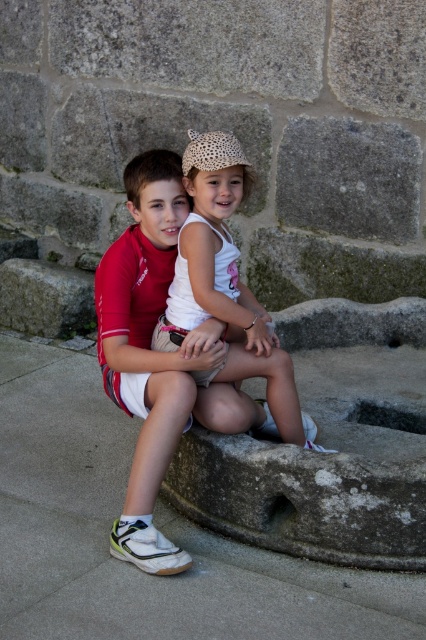
You are a photographer trying to capture a photo of the matte white shirt at center. Based on the coordinates provided in the scene description, where should you position your camera to ensure the shirt is centered in the frame?

The matte white shirt at center is located at point (169, 358), so you should position your camera to aim directly at those coordinates to center it in the frame.

You are a parent trying to decide which stone to let your child sit on. The gray rough stone at center and the green rough stone at center are both available. Which one has a wider surface for sitting?

The gray rough stone at center has a larger width than the green rough stone at center, so it provides a wider surface for sitting.

You see a matte white shirt at center and a green rough stone at center in the image. Which object is located to the right of the other?

The matte white shirt at center is positioned on the right side of green rough stone at center.